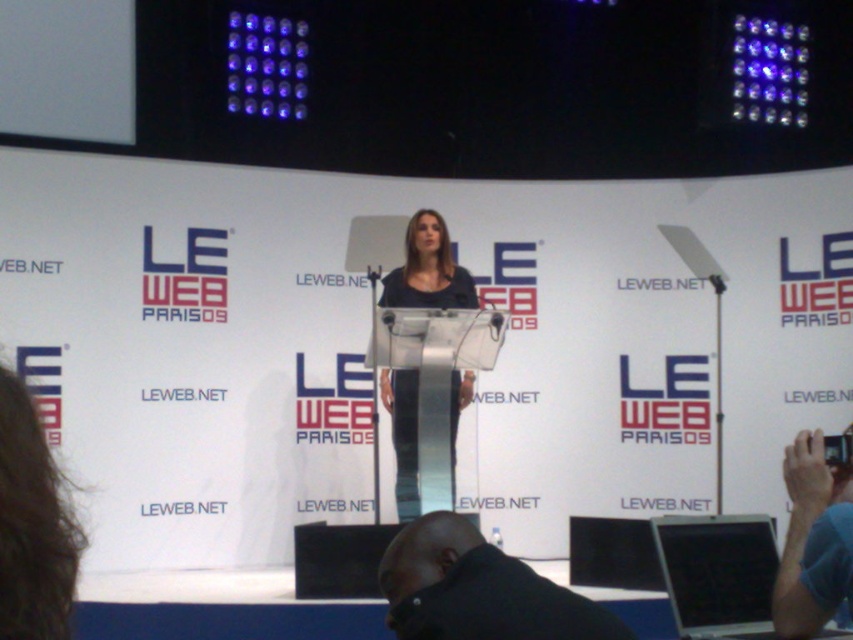
Question: Is black matte shirt at lower center positioned before white plastic laptop at lower right?

Choices:
 (A) no
 (B) yes

Answer: (B)

Question: From the image, what is the correct spatial relationship of black matte shirt at lower center in relation to matte black dress at center?

Choices:
 (A) left
 (B) right

Answer: (B)

Question: Which of the following is the closest to the observer?

Choices:
 (A) (680, 596)
 (B) (415, 280)

Answer: (A)

Question: Which object is closer to the camera taking this photo?

Choices:
 (A) black matte shirt at lower center
 (B) white plastic laptop at lower right

Answer: (A)

Question: Which of these objects is positioned farthest from the matte black dress at center?

Choices:
 (A) black matte shirt at lower center
 (B) white plastic laptop at lower right

Answer: (A)

Question: Can you confirm if black matte shirt at lower center is positioned above matte black dress at center?

Choices:
 (A) yes
 (B) no

Answer: (A)